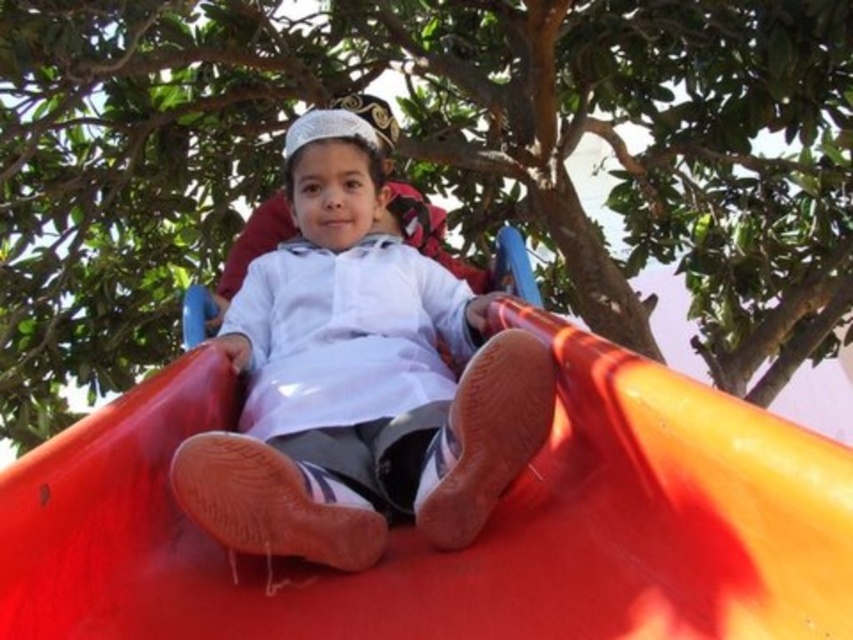
Question: Which object is closer to the camera taking this photo?

Choices:
 (A) white matte shirt at center
 (B) green leafy tree at upper center
 (C) rubberized red slide at center

Answer: (C)

Question: Does green leafy tree at upper center appear on the right side of white matte shirt at center?

Choices:
 (A) no
 (B) yes

Answer: (B)

Question: Which of the following is the farthest from the observer?

Choices:
 (A) (143, 310)
 (B) (376, 170)
 (C) (717, 428)

Answer: (A)

Question: Is green leafy tree at upper center positioned behind white matte shirt at center?

Choices:
 (A) no
 (B) yes

Answer: (B)

Question: Does green leafy tree at upper center appear on the right side of rubberized red slide at center?

Choices:
 (A) yes
 (B) no

Answer: (A)

Question: Among these points, which one is nearest to the camera?

Choices:
 (A) (827, 522)
 (B) (346, 172)

Answer: (A)